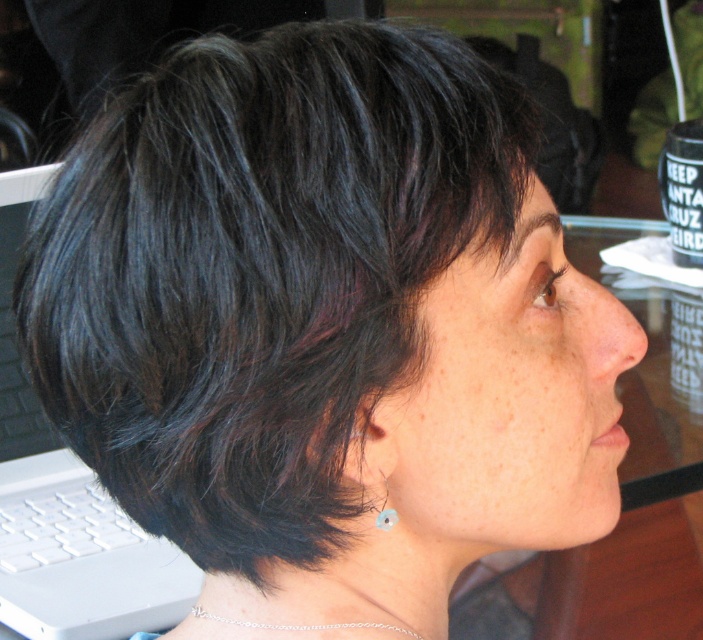
Question: Estimate the real-world distances between objects in this image. Which object is closer to the silver chain necklace at lower center?

Choices:
 (A) pearl-like earring at lower center
 (B) white plastic laptop at left

Answer: (A)

Question: Is the position of white plastic laptop at left less distant than that of silver chain necklace at lower center?

Choices:
 (A) no
 (B) yes

Answer: (A)

Question: Is white plastic laptop at left to the left of silver chain necklace at lower center from the viewer's perspective?

Choices:
 (A) yes
 (B) no

Answer: (A)

Question: Which object is farther from the camera taking this photo?

Choices:
 (A) silver chain necklace at lower center
 (B) pearl-like earring at lower center

Answer: (A)

Question: Among these points, which one is nearest to the camera?

Choices:
 (A) (349, 625)
 (B) (380, 506)

Answer: (B)

Question: Can you confirm if white plastic laptop at left is bigger than pearl-like earring at lower center?

Choices:
 (A) no
 (B) yes

Answer: (B)